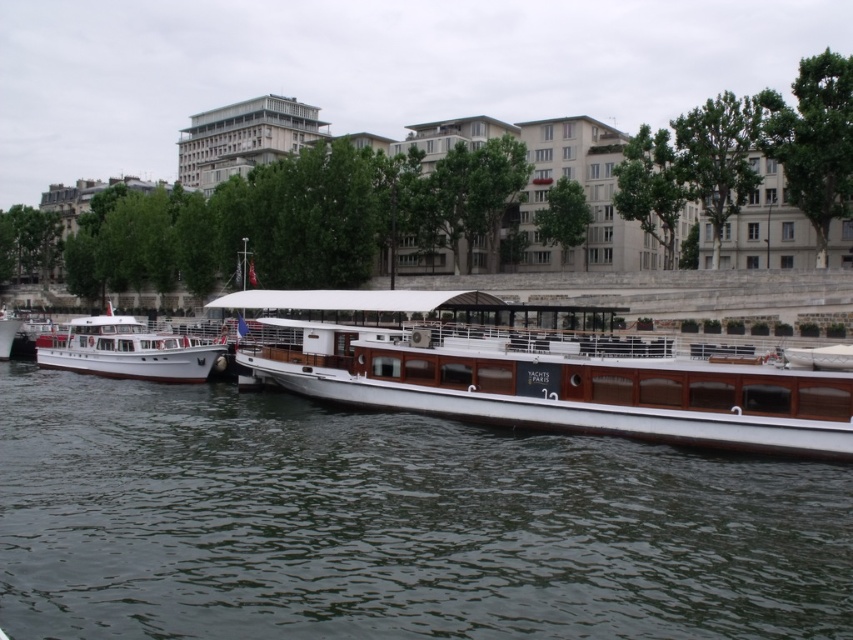
Does smooth dark water at center appear on the right side of white polished wood boat at center?

Incorrect, smooth dark water at center is not on the right side of white polished wood boat at center.

In the scene shown: Which is above, smooth dark water at center or white polished wood boat at center?

Positioned higher is white polished wood boat at center.

The height and width of the screenshot is (640, 853). What do you see at coordinates (392, 524) in the screenshot? I see `smooth dark water at center` at bounding box center [392, 524].

Locate an element on the screen. The height and width of the screenshot is (640, 853). smooth dark water at center is located at coordinates (392, 524).

Is point (701, 376) positioned before point (97, 321)?

Yes, point (701, 376) is closer to viewer.

Is white polished wood boat at center bigger than white matte boat at left?

Yes, white polished wood boat at center is bigger than white matte boat at left.

The image size is (853, 640). Identify the location of white polished wood boat at center. (541, 369).

This screenshot has height=640, width=853. Identify the location of white polished wood boat at center. (541, 369).

Between smooth dark water at center and white matte boat at left, which one appears on the right side from the viewer's perspective?

Positioned to the right is smooth dark water at center.

Who is shorter, smooth dark water at center or white matte boat at left?

white matte boat at left

Between point (109, 621) and point (175, 348), which one is positioned behind?

The point (175, 348) is behind.

Locate an element on the screen. Image resolution: width=853 pixels, height=640 pixels. smooth dark water at center is located at coordinates (392, 524).